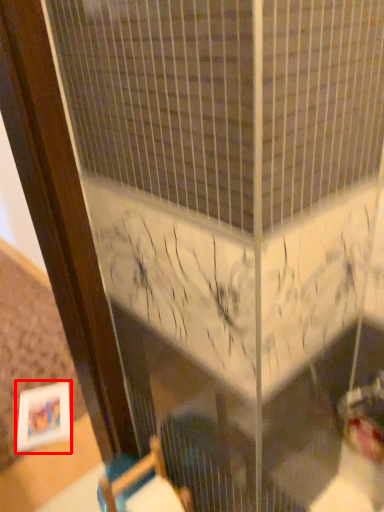
Question: Considering the relative positions of picture frame (annotated by the red box) and furniture in the image provided, where is picture frame (annotated by the red box) located with respect to the staircase?

Choices:
 (A) right
 (B) left

Answer: (B)